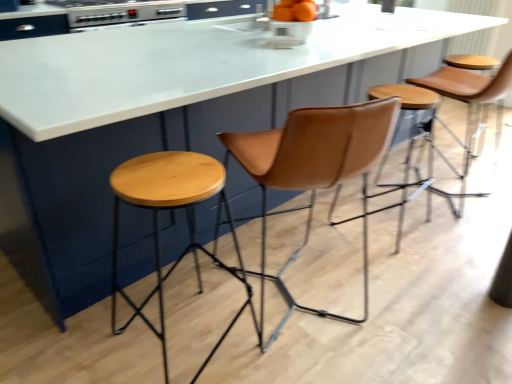
Where is `unoccupied region to the right of brown leather swivel chair at center`? The image size is (512, 384). unoccupied region to the right of brown leather swivel chair at center is located at coordinates (422, 302).